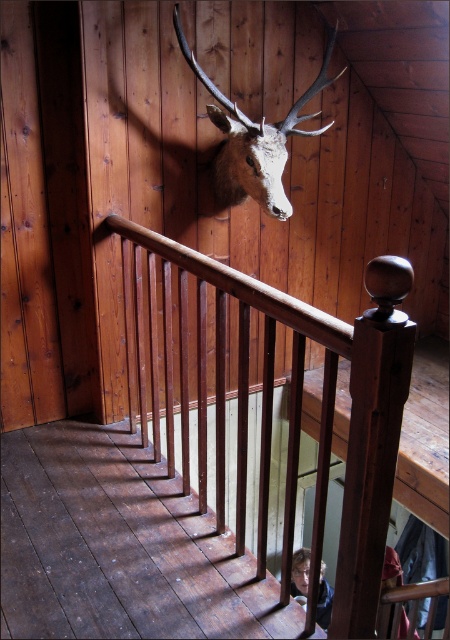
Question: Which object is closer to the camera taking this photo?

Choices:
 (A) wooden stair at lower center
 (B) matte brown deer head at upper center
 (C) smooth brown hair at lower center

Answer: (A)

Question: Is matte brown deer head at upper center positioned before smooth brown hair at lower center?

Choices:
 (A) yes
 (B) no

Answer: (A)

Question: Which object is closer to the camera taking this photo?

Choices:
 (A) smooth brown hair at lower center
 (B) wooden polished rail at center
 (C) wooden stair at lower center
 (D) matte brown deer head at upper center

Answer: (B)

Question: Is wooden stair at lower center behind smooth brown hair at lower center?

Choices:
 (A) yes
 (B) no

Answer: (B)

Question: Estimate the real-world distances between objects in this image. Which object is closer to the matte brown deer head at upper center?

Choices:
 (A) wooden polished rail at center
 (B) smooth brown hair at lower center

Answer: (A)

Question: Is wooden stair at lower center smaller than matte brown deer head at upper center?

Choices:
 (A) no
 (B) yes

Answer: (A)